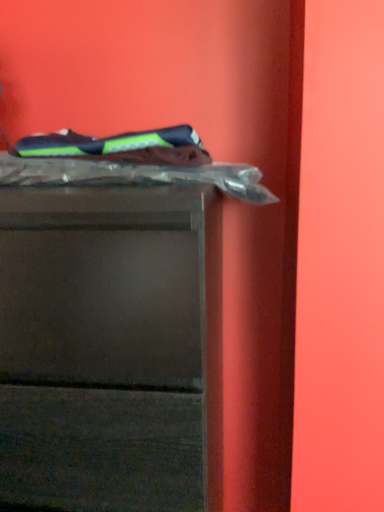
Question: Is dark blue fabric at upper left, the 2th laundry positioned from the bottom, inside or outside of clear plastic laundry at upper center, the 2th laundry from the top?

Choices:
 (A) inside
 (B) outside

Answer: (B)

Question: Is dark blue fabric at upper left, which is the 1th laundry from top to bottom, wider or thinner than clear plastic laundry at upper center, the 2th laundry from the top?

Choices:
 (A) thin
 (B) wide

Answer: (A)

Question: Which is nearer to the dark blue fabric at upper left, which is the 1th laundry from top to bottom?

Choices:
 (A) matte plastic chest of drawers at upper left
 (B) clear plastic laundry at upper center, the 2th laundry from the top

Answer: (B)

Question: Which object is positioned closest to the clear plastic laundry at upper center, the 1th laundry from the bottom?

Choices:
 (A) dark blue fabric at upper left, the 2th laundry positioned from the bottom
 (B) matte plastic chest of drawers at upper left

Answer: (A)